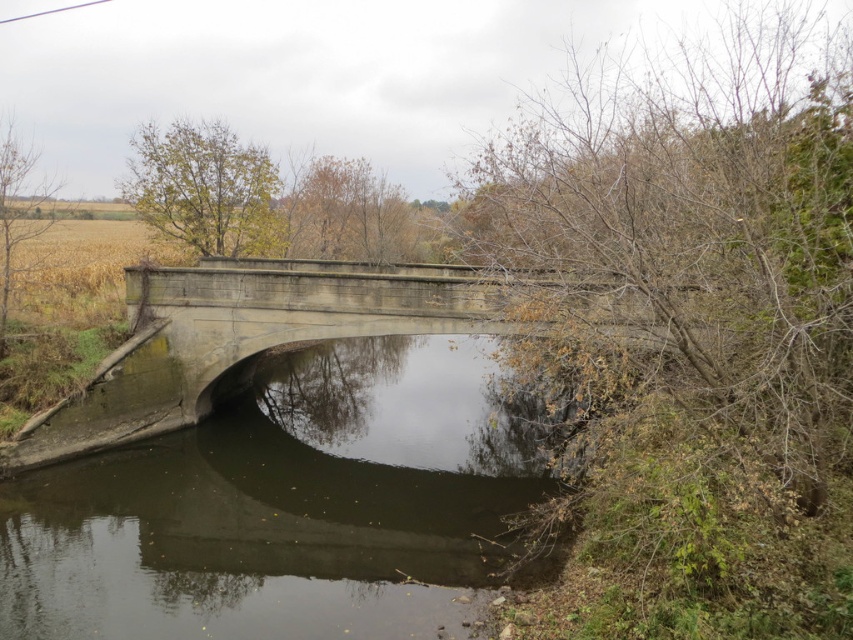
Question: Which of the following is the farthest from the observer?

Choices:
 (A) (96, 627)
 (B) (239, 298)

Answer: (B)

Question: In this image, where is dark gray concrete river at center located relative to gray concrete bridge at center?

Choices:
 (A) right
 (B) left

Answer: (A)

Question: From the image, what is the correct spatial relationship of dark gray concrete river at center in relation to gray concrete bridge at center?

Choices:
 (A) right
 (B) left

Answer: (A)

Question: Does dark gray concrete river at center appear on the left side of gray concrete bridge at center?

Choices:
 (A) yes
 (B) no

Answer: (B)